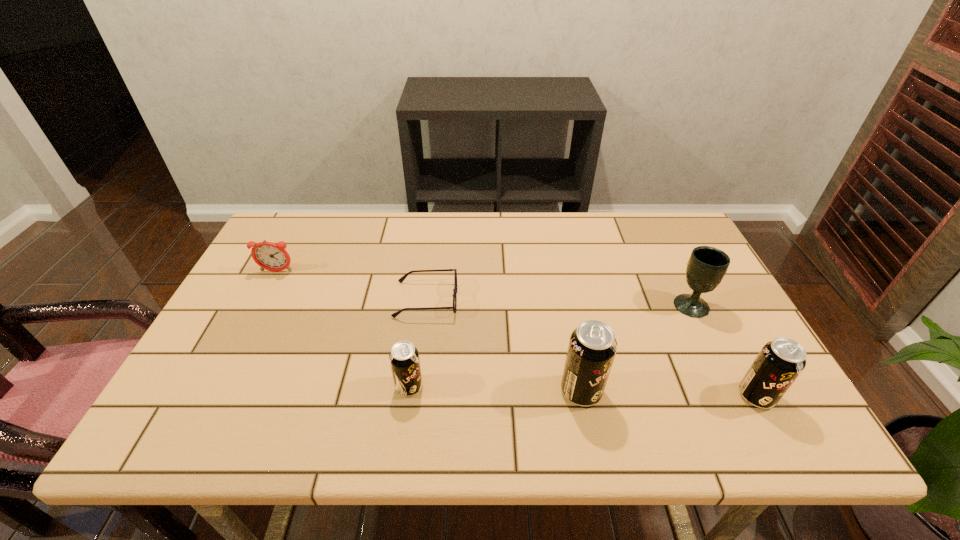
You are a GUI agent. You are given a task and a screenshot of the screen. Output one action in this format:
    pyautogui.click(x=<x>, y=<y>)
    Task: Click on the vacant area at the left edge
    The height and width of the screenshot is (540, 960).
    Given the screenshot: What is the action you would take?
    pyautogui.click(x=245, y=287)

This screenshot has width=960, height=540. Identify the location of free space at the right edge of the desktop. (664, 275).

Find the location of a particular element. The width and height of the screenshot is (960, 540). vacant space at the far left corner is located at coordinates point(272,239).

Locate an element on the screen. The width and height of the screenshot is (960, 540). vacant space at the far right corner of the desktop is located at coordinates (643, 225).

Find the location of a particular element. vacant space at the near right corner is located at coordinates (718, 375).

The image size is (960, 540). Identify the location of free space between the spectacles and the leftmost object. (351, 286).

You are a GUI agent. You are given a task and a screenshot of the screen. Output one action in this format:
    pyautogui.click(x=<x>, y=<y>)
    Task: Click on the blank region between the fifth tallest object and the second tallest soda can
    This screenshot has width=960, height=540.
    Given the screenshot: What is the action you would take?
    pyautogui.click(x=516, y=334)

Locate an element on the screen. The height and width of the screenshot is (540, 960). free space that is in between the leftmost soda can and the second soda can from right to left is located at coordinates (495, 389).

Where is `vacant area between the rightmost soda can and the chalice`? vacant area between the rightmost soda can and the chalice is located at coordinates (724, 350).

I want to click on free area in between the spectacles and the chalice, so click(x=559, y=302).